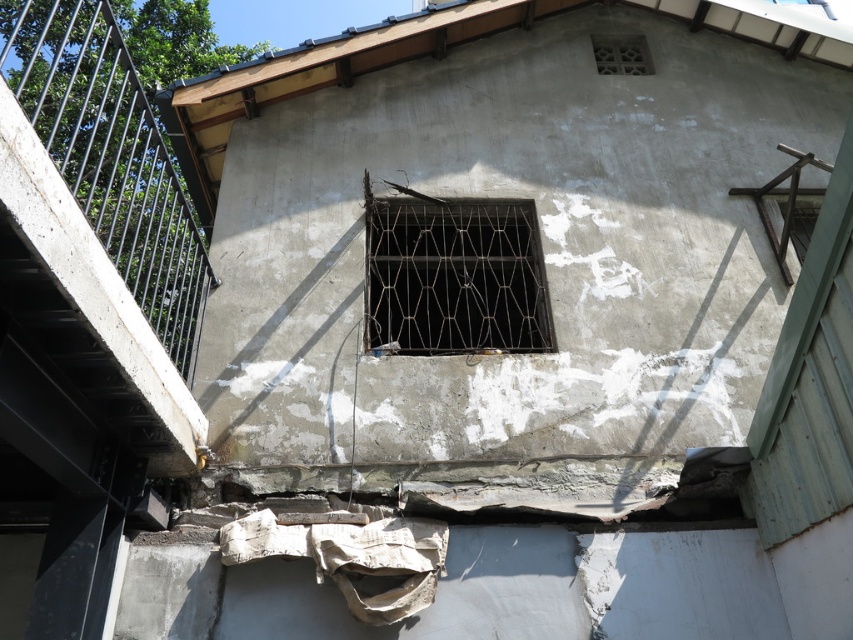
In the scene shown: You are a painter assessing the exterior wall of a building. You need to determine which object, the black metal railing at upper left or the white textured vent at upper center, requires more paint due to its width. Based on the scene, which one would need more paint?

The white textured vent at upper center requires more paint because it is wider than the black metal railing at upper left.

You are a maintenance worker needing to reach the white textured vent at upper center from the black metal grid at center. The ladder you have is 2.5 meters long. Can you safely reach the vent using the ladder from the grid?

The distance between the black metal grid at center and the white textured vent at upper center is 2.70 meters. Since the ladder is only 2.5 meters long, it is not long enough to safely reach the vent from the grid.

You are a maintenance worker assessing the building exterior. You notice the black metal railing at upper left and the black metal grid at center. Which one is closer to you as you stand in front of the building?

The black metal railing at upper left is closer to you because it is in front of the black metal grid at center, which is positioned behind it.